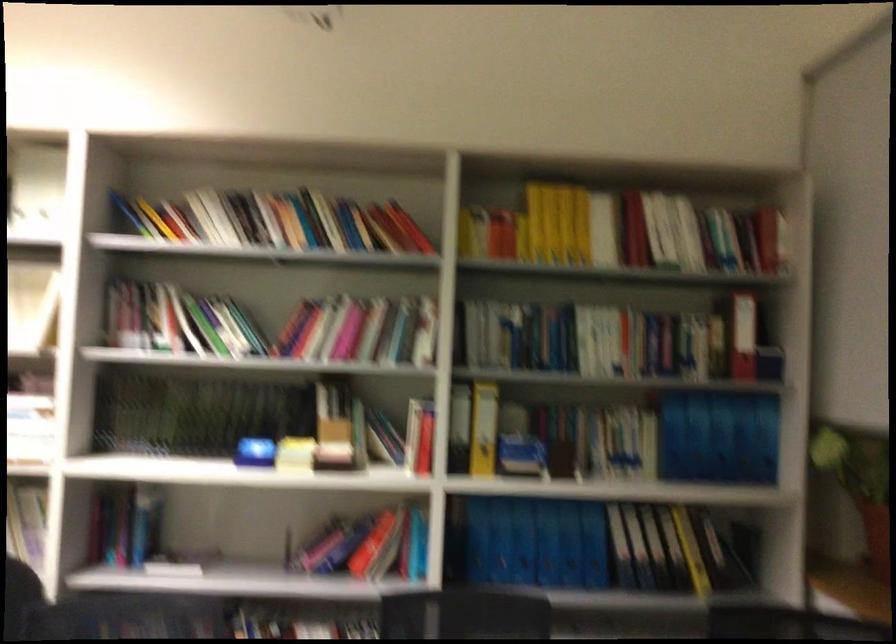
Identify the location of black binder. (716, 554).